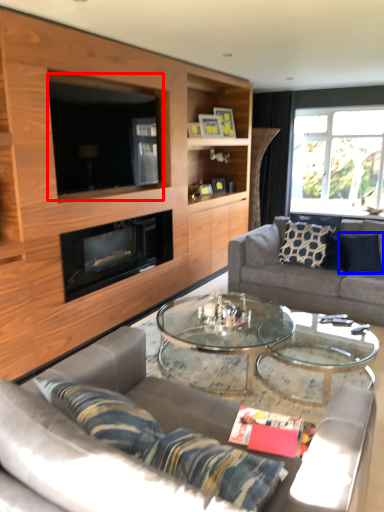
Question: Which object appears closest to the camera in this image, window screen (highlighted by a red box) or pillow (highlighted by a blue box)?

Choices:
 (A) window screen
 (B) pillow

Answer: (A)